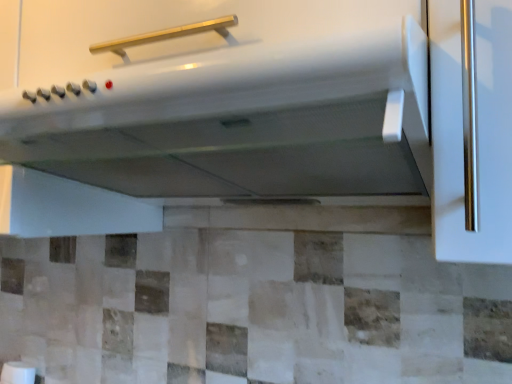
Describe the element at coordinates (294, 124) in the screenshot. I see `white glossy range hood at center` at that location.

Find the location of a particular element. Image resolution: width=512 pixels, height=384 pixels. white glossy range hood at center is located at coordinates (294, 124).

What is the approximate width of white glossy range hood at center?

white glossy range hood at center is 21.20 inches wide.

Where is `white glossy range hood at center`? white glossy range hood at center is located at coordinates (294, 124).